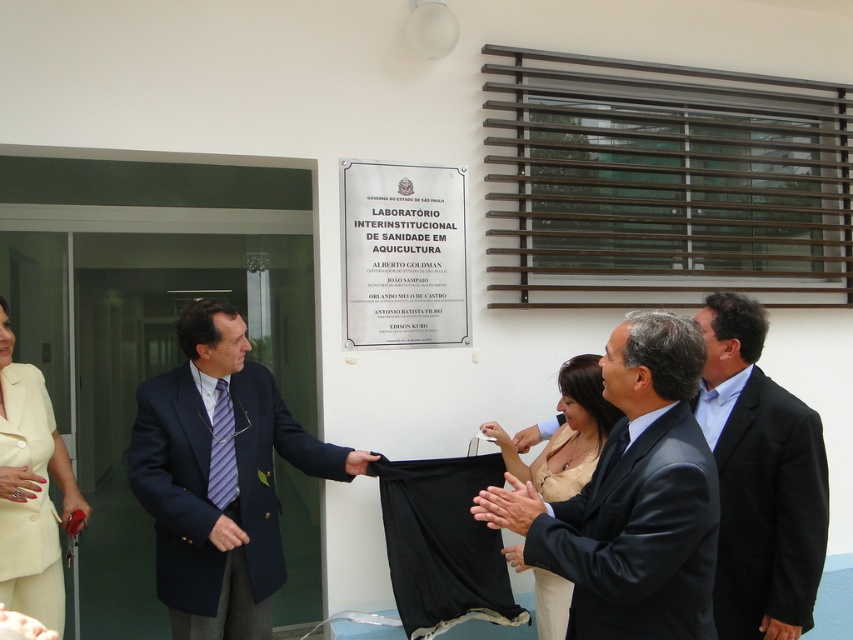
Does dark gray suit at center appear on the right side of matte cream suit at lower left?

Yes, dark gray suit at center is to the right of matte cream suit at lower left.

What do you see at coordinates (633, 497) in the screenshot? I see `dark gray suit at center` at bounding box center [633, 497].

Where is `dark gray suit at center`? dark gray suit at center is located at coordinates [x=633, y=497].

Between navy blue suit at center and matte cream suit at lower left, which one appears on the right side from the viewer's perspective?

From the viewer's perspective, navy blue suit at center appears more on the right side.

Which is behind, point (215, 518) or point (61, 522)?

The point (61, 522) is behind.

Identify the location of navy blue suit at center. (219, 477).

Is dark gray suit at center to the left of smooth skin hand at center from the viewer's perspective?

No, dark gray suit at center is not to the left of smooth skin hand at center.

Who is more forward, (643, 472) or (498, 432)?

Positioned in front is point (643, 472).

This screenshot has height=640, width=853. Describe the element at coordinates (633, 497) in the screenshot. I see `dark gray suit at center` at that location.

You are a GUI agent. You are given a task and a screenshot of the screen. Output one action in this format:
    pyautogui.click(x=<x>, y=<y>)
    Task: Click on the dark gray suit at center
    
    Given the screenshot: What is the action you would take?
    pyautogui.click(x=633, y=497)